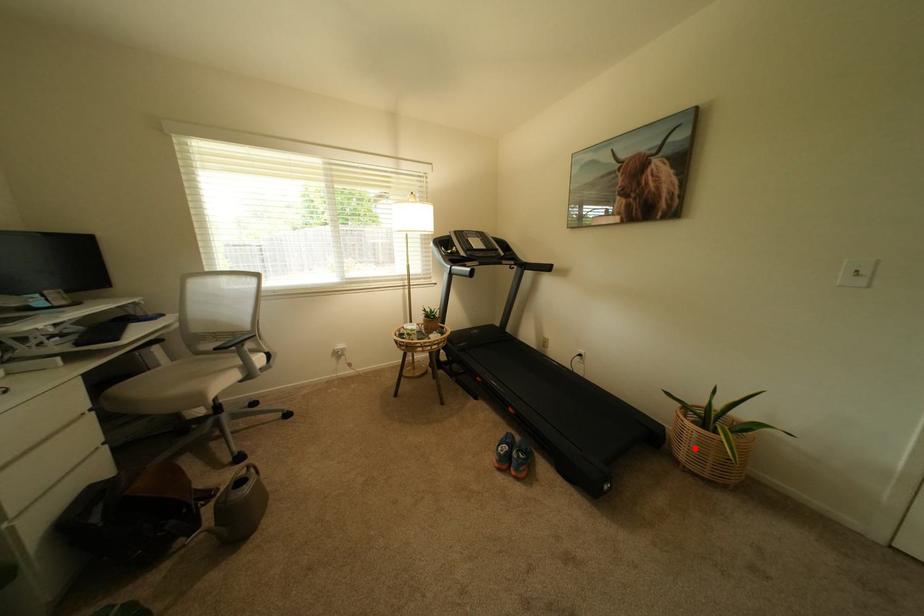
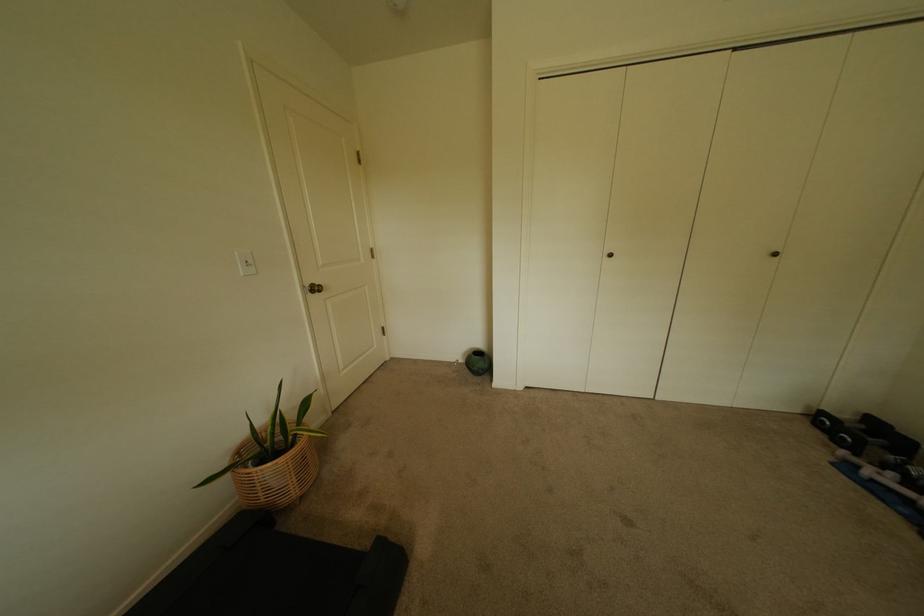
Where in the second image is the point corresponding to the highlighted location from the first image?

(302, 480)